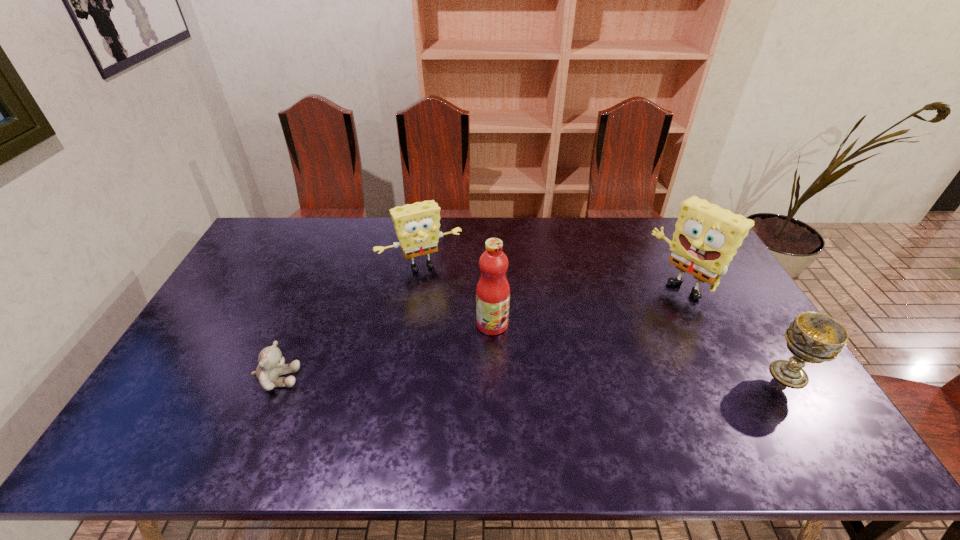
Find the location of a particular element. The image size is (960, 540). vacant area at the right edge is located at coordinates (741, 328).

Image resolution: width=960 pixels, height=540 pixels. In the image, there is a desktop. Find the location of `vacant space at the far left corner`. vacant space at the far left corner is located at coordinates (255, 255).

Locate an element on the screen. This screenshot has width=960, height=540. vacant space at the near left corner is located at coordinates (212, 389).

The height and width of the screenshot is (540, 960). I want to click on free space at the near right corner of the desktop, so click(795, 389).

Where is `empty location between the fruit juice and the right sponge`? empty location between the fruit juice and the right sponge is located at coordinates (587, 306).

This screenshot has height=540, width=960. In order to click on vacant area that lies between the teddy bear and the fruit juice in this screenshot , I will do `click(385, 351)`.

Locate an element on the screen. The width and height of the screenshot is (960, 540). vacant space in between the taller sponge and the fruit juice is located at coordinates (587, 306).

You are a GUI agent. You are given a task and a screenshot of the screen. Output one action in this format:
    pyautogui.click(x=<x>, y=<y>)
    Task: Click on the vacant region between the fourth object from right to left and the fourth tallest object
    The height and width of the screenshot is (540, 960).
    Given the screenshot: What is the action you would take?
    [x=605, y=320]

You are a GUI agent. You are given a task and a screenshot of the screen. Output one action in this format:
    pyautogui.click(x=<x>, y=<y>)
    Task: Click on the free space between the right sponge and the teddy bear
    
    Given the screenshot: What is the action you would take?
    pyautogui.click(x=479, y=334)

At what (x,y) coordinates should I click in order to perform the action: click on free spot between the chalice and the fourth object from left to right. Please return your answer as a coordinate pair (x, y). The width and height of the screenshot is (960, 540). Looking at the image, I should click on (734, 331).